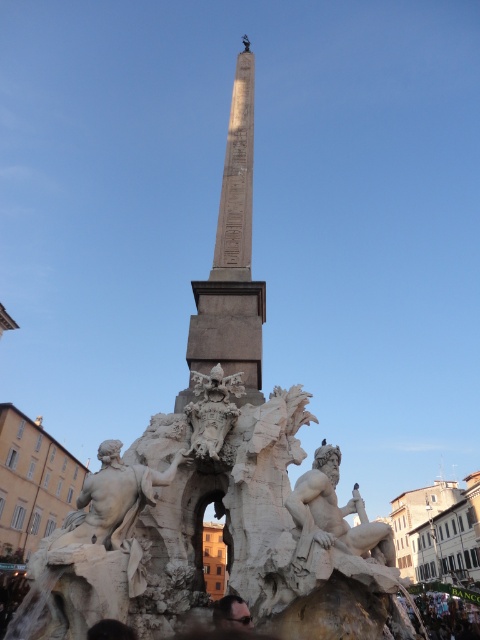
Locate an element on the screen. white stone figure at center is located at coordinates [x=335, y=513].

Is point (364, 532) closer to viewer compared to point (239, 614)?

No, (364, 532) is behind (239, 614).

The image size is (480, 640). I want to click on white stone figure at center, so click(335, 513).

Based on the photo, can you confirm if white stone obelisk at center is thinner than white stone figure at center?

Correct, white stone obelisk at center's width is less than white stone figure at center's.

Which is more to the left, white stone obelisk at center or white stone figure at center?

Positioned to the left is white stone obelisk at center.

Between point (243, 138) and point (304, 557), which one is positioned in front?

Point (304, 557)

Locate an element on the screen. white stone obelisk at center is located at coordinates (231, 260).

Does white stone obelisk at center have a larger size compared to white stone sculpture at center?

Correct, white stone obelisk at center is larger in size than white stone sculpture at center.

Between white stone obelisk at center and white stone sculpture at center, which one appears on the right side from the viewer's perspective?

white stone obelisk at center

Is point (215, 269) positioned behind point (223, 420)?

Yes, point (215, 269) is farther from viewer.

Locate an element on the screen. This screenshot has height=640, width=480. white stone obelisk at center is located at coordinates (231, 260).